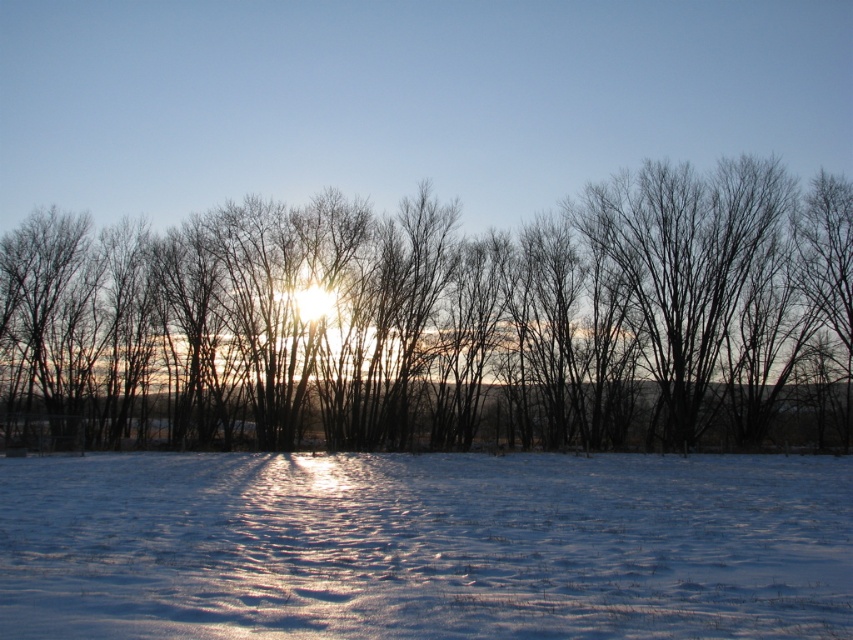
Can you confirm if bare branches at center is positioned above white powdery snow at lower center?

Yes, bare branches at center is above white powdery snow at lower center.

Does point (657, 260) come farther from viewer compared to point (578, 502)?

Yes, it is behind point (578, 502).

The height and width of the screenshot is (640, 853). What do you see at coordinates (442, 323) in the screenshot? I see `bare branches at center` at bounding box center [442, 323].

You are a GUI agent. You are given a task and a screenshot of the screen. Output one action in this format:
    pyautogui.click(x=<x>, y=<y>)
    Task: Click on the bare branches at center
    Image resolution: width=853 pixels, height=640 pixels.
    Given the screenshot: What is the action you would take?
    pyautogui.click(x=442, y=323)